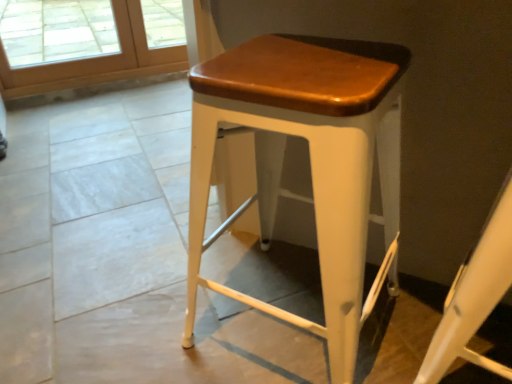
Question: Is wooden screen door at upper left smaller than white matte stool at center?

Choices:
 (A) yes
 (B) no

Answer: (B)

Question: Is wooden screen door at upper left bigger than white matte stool at center?

Choices:
 (A) yes
 (B) no

Answer: (A)

Question: Does wooden screen door at upper left lie in front of white matte stool at center?

Choices:
 (A) yes
 (B) no

Answer: (B)

Question: Is wooden screen door at upper left oriented away from white matte stool at center?

Choices:
 (A) yes
 (B) no

Answer: (B)

Question: Considering the relative sizes of wooden screen door at upper left and white matte stool at center in the image provided, is wooden screen door at upper left taller than white matte stool at center?

Choices:
 (A) yes
 (B) no

Answer: (B)

Question: From the image's perspective, relative to matte white stool at center, is white matte stool at center above or below?

Choices:
 (A) below
 (B) above

Answer: (A)

Question: Based on their positions, is white matte stool at center located to the left or right of matte white stool at center?

Choices:
 (A) right
 (B) left

Answer: (A)

Question: Considering their positions, is white matte stool at center located in front of or behind matte white stool at center?

Choices:
 (A) behind
 (B) front

Answer: (B)

Question: From a real-world perspective, is white matte stool at center positioned above or below matte white stool at center?

Choices:
 (A) below
 (B) above

Answer: (B)

Question: Is matte white stool at center in front of or behind wooden screen door at upper left in the image?

Choices:
 (A) front
 (B) behind

Answer: (A)

Question: From a real-world perspective, relative to wooden screen door at upper left, is matte white stool at center vertically above or below?

Choices:
 (A) above
 (B) below

Answer: (A)

Question: Is point (355, 94) positioned closer to the camera than point (154, 66)?

Choices:
 (A) farther
 (B) closer

Answer: (B)

Question: In terms of height, does matte white stool at center look taller or shorter compared to wooden screen door at upper left?

Choices:
 (A) short
 (B) tall

Answer: (B)

Question: Would you say wooden screen door at upper left is to the left or to the right of white matte stool at center in the picture?

Choices:
 (A) right
 (B) left

Answer: (B)

Question: Considering the positions of wooden screen door at upper left and white matte stool at center in the image, is wooden screen door at upper left bigger or smaller than white matte stool at center?

Choices:
 (A) small
 (B) big

Answer: (B)